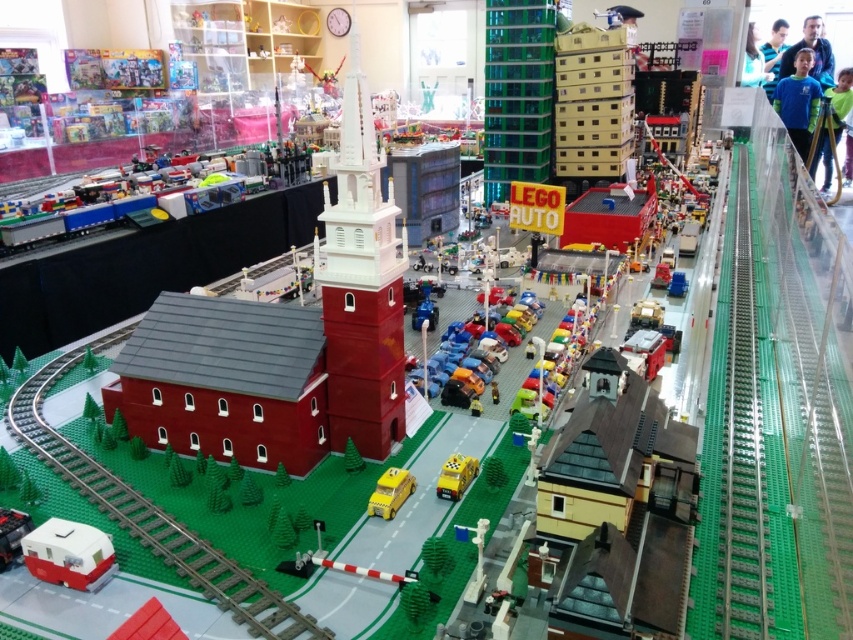
You are a Lego figure standing on the sidewalk next to the red brick building with a gray roof. You see the shiny plastic cars at center and the yellow plastic taxi at center. Which one is positioned to the right?

The shiny plastic cars at center is to the right of the yellow plastic taxi at center.

You are a Lego figure standing on the sidewalk next to the shiny plastic cars at center and the yellow plastic taxi at center. Which vehicle do you need to look up to see the top of?

You need to look up to see the top of the shiny plastic cars at center because it is taller than the yellow plastic taxi at center.

Consider the image. You are standing at the point marked by coordinates point (390, 492) in the Lego cityscape. What object are you standing on?

You are standing on the yellow plastic taxi at center, as the coordinates point (390, 492) marks this object.